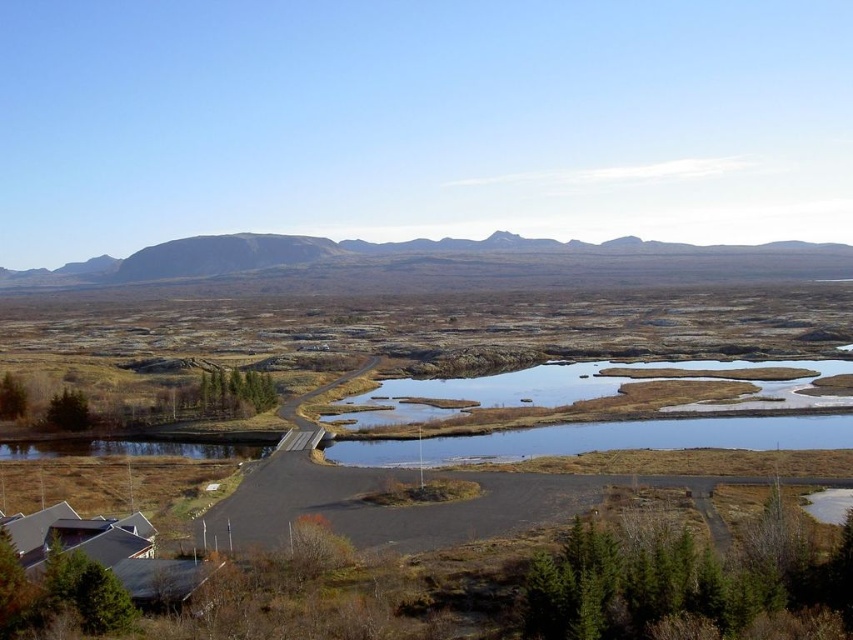
Question: Which point is closer to the camera taking this photo?

Choices:
 (A) (149, 275)
 (B) (750, 419)

Answer: (B)

Question: Which of the following is the closest to the observer?

Choices:
 (A) (758, 253)
 (B) (473, 458)

Answer: (B)

Question: Is brown grassy lake at center above gray rocky mountain at center?

Choices:
 (A) no
 (B) yes

Answer: (A)

Question: Is brown grassy lake at center above gray rocky mountain at center?

Choices:
 (A) no
 (B) yes

Answer: (A)

Question: Which point is farther to the camera?

Choices:
 (A) (685, 260)
 (B) (729, 417)

Answer: (A)

Question: Is brown grassy lake at center thinner than gray rocky mountain at center?

Choices:
 (A) yes
 (B) no

Answer: (A)